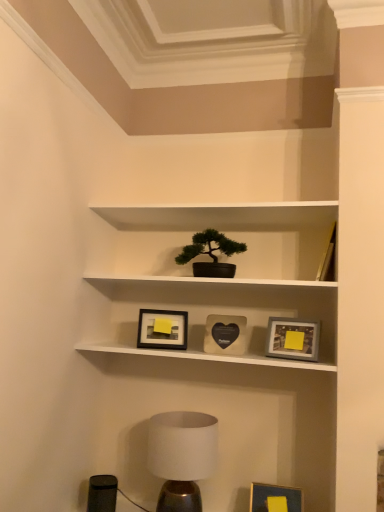
Question: Which direction should I rotate to look at matte black picture frame at center, acting as the 4th picture frame starting from the right?

Choices:
 (A) left
 (B) right

Answer: (A)

Question: Considering the relative sizes of matte black heart-shaped picture frame at center, the first picture frame viewed from the top, and white matte shelf at center in the image provided, is matte black heart-shaped picture frame at center, the first picture frame viewed from the top, bigger than white matte shelf at center?

Choices:
 (A) no
 (B) yes

Answer: (A)

Question: From a real-world perspective, is matte black heart-shaped picture frame at center, which is counted as the second picture frame, starting from the left, on white matte shelf at center?

Choices:
 (A) yes
 (B) no

Answer: (B)

Question: From the image's perspective, is matte black heart-shaped picture frame at center, which is counted as the second picture frame, starting from the left, on top of white matte shelf at center?

Choices:
 (A) yes
 (B) no

Answer: (B)

Question: Is matte black heart-shaped picture frame at center, the first picture frame viewed from the top, located outside white matte shelf at center?

Choices:
 (A) no
 (B) yes

Answer: (A)

Question: Does matte black heart-shaped picture frame at center, which is the 4th picture frame from bottom to top, have a lesser width compared to white matte shelf at center?

Choices:
 (A) yes
 (B) no

Answer: (A)

Question: Does matte black heart-shaped picture frame at center, which is counted as the second picture frame, starting from the left, come in front of white matte shelf at center?

Choices:
 (A) no
 (B) yes

Answer: (A)

Question: Is matte blue picture frame at lower right, which ranks as the 3th picture frame in left-to-right order, completely or partially outside of green matte houseplant at upper center?

Choices:
 (A) yes
 (B) no

Answer: (A)

Question: Does matte blue picture frame at lower right, the second picture frame viewed from the right, have a greater height compared to green matte houseplant at upper center?

Choices:
 (A) yes
 (B) no

Answer: (A)

Question: Considering the relative sizes of matte blue picture frame at lower right, the second picture frame viewed from the right, and green matte houseplant at upper center in the image provided, is matte blue picture frame at lower right, the second picture frame viewed from the right, wider than green matte houseplant at upper center?

Choices:
 (A) no
 (B) yes

Answer: (A)

Question: Does matte blue picture frame at lower right, the 1th picture frame in the bottom-to-top sequence, have a larger size compared to green matte houseplant at upper center?

Choices:
 (A) yes
 (B) no

Answer: (B)

Question: Is matte blue picture frame at lower right, the 1th picture frame in the bottom-to-top sequence, behind green matte houseplant at upper center?

Choices:
 (A) yes
 (B) no

Answer: (B)

Question: Can you confirm if matte blue picture frame at lower right, the second picture frame viewed from the right, is positioned to the left of green matte houseplant at upper center?

Choices:
 (A) yes
 (B) no

Answer: (B)

Question: From a real-world perspective, is matte gray picture frame at center right, the 1th picture frame positioned from the right, under green matte houseplant at upper center?

Choices:
 (A) yes
 (B) no

Answer: (A)